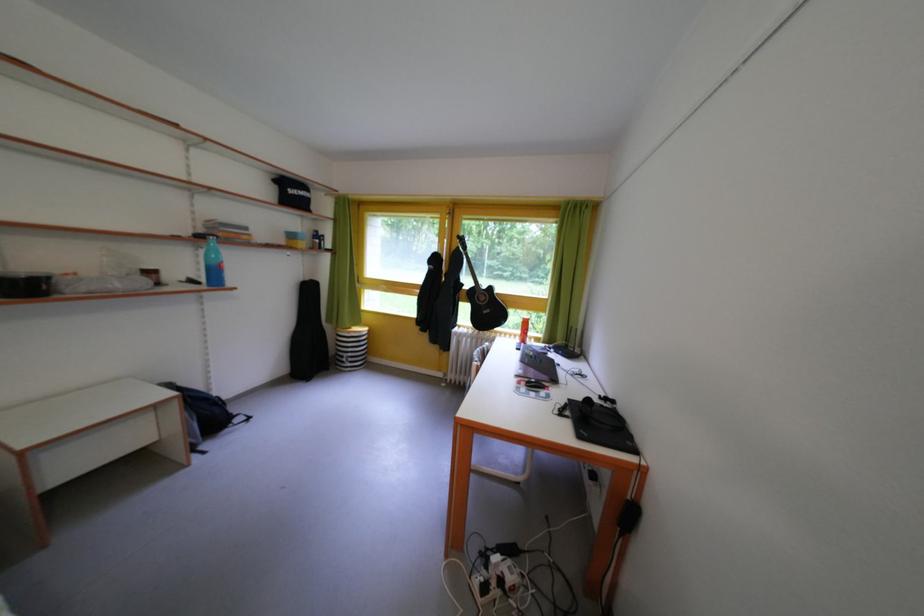
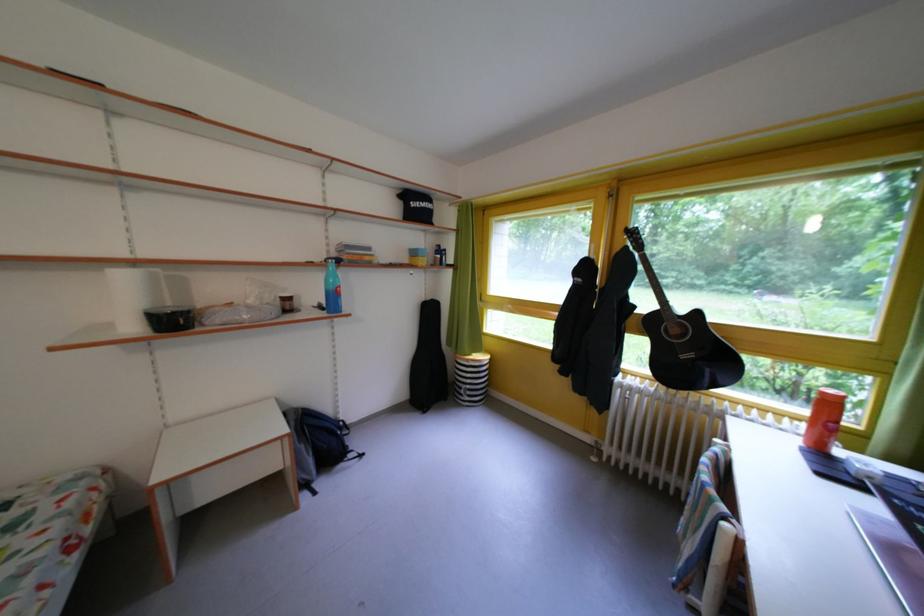
The point at (450,257) is marked in the first image. Where is the corresponding point in the second image?

(602, 262)